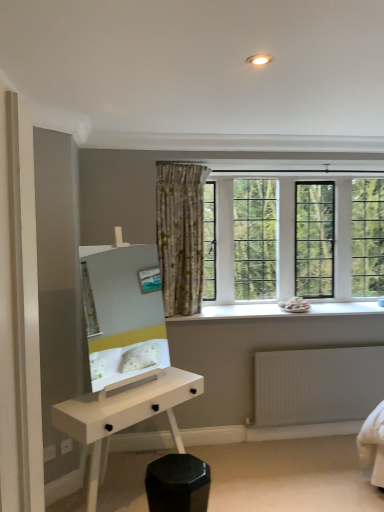
The width and height of the screenshot is (384, 512). Describe the element at coordinates (177, 484) in the screenshot. I see `black matte hexagonal stool at lower center` at that location.

What do you see at coordinates (316, 231) in the screenshot? I see `clear glass windows at upper center` at bounding box center [316, 231].

At what (x,y) coordinates should I click in order to perform the action: click on black matte hexagonal stool at lower center. Please return your answer as a coordinate pair (x, y). The width and height of the screenshot is (384, 512). Looking at the image, I should click on (177, 484).

What's the angular difference between clear glass windows at upper center and white glossy desk at lower center's facing directions?

The facing directions of clear glass windows at upper center and white glossy desk at lower center are 36.2 degrees apart.

In the scene shown: Is clear glass windows at upper center looking in the opposite direction of white glossy desk at lower center?

No.

Does clear glass windows at upper center appear on the left side of white glossy desk at lower center?

No.

This screenshot has width=384, height=512. I want to click on desk to the left of clear glass windows at upper center, so click(x=123, y=417).

Who is smaller, white stone window sill at center or white glossy mirror at center?

With smaller size is white stone window sill at center.

The width and height of the screenshot is (384, 512). In order to click on window sill below the white glossy mirror at center (from the image's perspective) in this screenshot , I will do pos(282,310).

From a real-world perspective, who is located higher, white stone window sill at center or white glossy mirror at center?

white glossy mirror at center is physically above.

From the image's perspective, is white stone window sill at center over white glossy mirror at center?

Actually, white stone window sill at center appears below white glossy mirror at center in the image.

Does white stone window sill at center have a greater width compared to clear glass windows at upper center?

Indeed, white stone window sill at center has a greater width compared to clear glass windows at upper center.

From the picture: Which of these two, white stone window sill at center or clear glass windows at upper center, stands shorter?

Standing shorter between the two is white stone window sill at center.

Between white stone window sill at center and clear glass windows at upper center, which one has smaller size?

Smaller between the two is white stone window sill at center.

From the image's perspective, is white stone window sill at center positioned above or below clear glass windows at upper center?

white stone window sill at center is below clear glass windows at upper center.

From a real-world perspective, is white glossy mirror at center positioned under white ribbed radiator at lower right based on gravity?

Actually, white glossy mirror at center is physically above white ribbed radiator at lower right in the real world.

Is white glossy mirror at center inside or outside of white ribbed radiator at lower right?

white glossy mirror at center is not inside white ribbed radiator at lower right, it's outside.

How far apart are white glossy mirror at center and white ribbed radiator at lower right?

white glossy mirror at center and white ribbed radiator at lower right are 1.21 meters apart from each other.

Is white glossy mirror at center far from white ribbed radiator at lower right?

white glossy mirror at center is far away from white ribbed radiator at lower right.

Which is behind, point (106, 401) or point (333, 406)?

The point (333, 406) is behind.

Is white glossy desk at lower center facing towards white ribbed radiator at lower right?

No, white glossy desk at lower center is not facing towards white ribbed radiator at lower right.

Considering the sizes of objects white glossy desk at lower center and white ribbed radiator at lower right in the image provided, who is thinner, white glossy desk at lower center or white ribbed radiator at lower right?

white ribbed radiator at lower right is thinner.

From the image's perspective, between white glossy desk at lower center and white ribbed radiator at lower right, which one is located above?

From the image's view, white ribbed radiator at lower right is above.

Is clear glass windows at upper center wider than white glossy mirror at center?

No, clear glass windows at upper center is not wider than white glossy mirror at center.

Does clear glass windows at upper center turn towards white glossy mirror at center?

No, clear glass windows at upper center is not turned towards white glossy mirror at center.

Based on their positions, is clear glass windows at upper center located to the left or right of white glossy mirror at center?

Clearly, clear glass windows at upper center is on the right of white glossy mirror at center in the image.

How many degrees apart are the facing directions of white glossy desk at lower center and white glossy mirror at center?

4.67 degrees.

From the image's perspective, between white glossy desk at lower center and white glossy mirror at center, who is located below?

white glossy desk at lower center is shown below in the image.

Considering the sizes of objects white glossy desk at lower center and white glossy mirror at center in the image provided, who is smaller, white glossy desk at lower center or white glossy mirror at center?

Smaller between the two is white glossy mirror at center.

Is white glossy desk at lower center positioned beyond the bounds of white glossy mirror at center?

Yes.

The height and width of the screenshot is (512, 384). I want to click on desk on the left side of clear glass windows at upper center, so click(x=123, y=417).

Find the location of a particular element. The image size is (384, 512). mirror above the white stone window sill at center (from a real-world perspective) is located at coordinates (123, 315).

Based on their spatial positions, is white stone window sill at center or white glossy desk at lower center further from black matte hexagonal stool at lower center?

white stone window sill at center.

From the image, which object appears to be nearer to clear glass windows at upper center, white glossy desk at lower center or black matte hexagonal stool at lower center?

white glossy desk at lower center is closer to clear glass windows at upper center.

Looking at the image, which one is located closer to white stone window sill at center, white ribbed radiator at lower right or white glossy mirror at center?

Among the two, white ribbed radiator at lower right is located nearer to white stone window sill at center.

Looking at the image, which one is located closer to black matte hexagonal stool at lower center, white glossy desk at lower center or white ribbed radiator at lower right?

white glossy desk at lower center.

Which object lies further to the anchor point black matte hexagonal stool at lower center, clear glass windows at upper center or white glossy desk at lower center?

clear glass windows at upper center is further to black matte hexagonal stool at lower center.

Based on their spatial positions, is black matte hexagonal stool at lower center or white stone window sill at center closer to white glossy desk at lower center?

Among the two, black matte hexagonal stool at lower center is located nearer to white glossy desk at lower center.

Considering their positions, is white ribbed radiator at lower right positioned further to white glossy mirror at center than clear glass windows at upper center?

white ribbed radiator at lower right is positioned further to the anchor white glossy mirror at center.

Which object lies further to the anchor point white glossy desk at lower center, white stone window sill at center or white glossy mirror at center?

white stone window sill at center is further to white glossy desk at lower center.

The width and height of the screenshot is (384, 512). Find the location of `window sill between white glossy mirror at center and clear glass windows at upper center from left to right`. window sill between white glossy mirror at center and clear glass windows at upper center from left to right is located at coordinates (282, 310).

The width and height of the screenshot is (384, 512). Find the location of `window sill between clear glass windows at upper center and white ribbed radiator at lower right from top to bottom`. window sill between clear glass windows at upper center and white ribbed radiator at lower right from top to bottom is located at coordinates (282, 310).

Where is `mirror located between white glossy desk at lower center and clear glass windows at upper center in the depth direction`? The height and width of the screenshot is (512, 384). mirror located between white glossy desk at lower center and clear glass windows at upper center in the depth direction is located at coordinates (123, 315).

Where is `stool between white glossy mirror at center and white ribbed radiator at lower right`? The width and height of the screenshot is (384, 512). stool between white glossy mirror at center and white ribbed radiator at lower right is located at coordinates (177, 484).